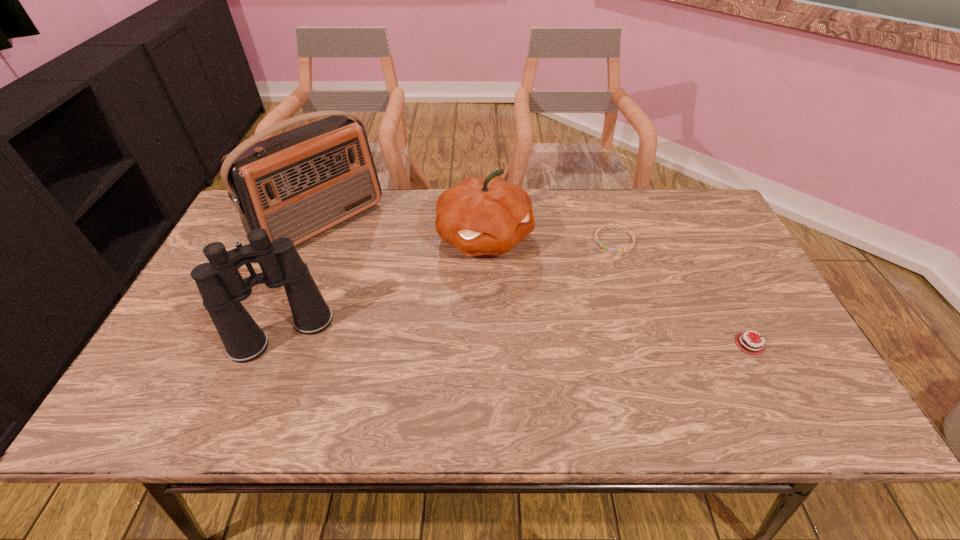
At what (x,y) coordinates should I click in order to perform the action: click on free spot on the desktop that is between the binoculars and the second shortest object and is positioned on the front face of the third object from left to right. Please return your answer as a coordinate pair (x, y). The height and width of the screenshot is (540, 960). Looking at the image, I should click on (558, 340).

The height and width of the screenshot is (540, 960). I want to click on vacant space on the desktop that is between the binoculars and the rightmost object and is positioned on the surface of the bracelet showing star-shaped elements, so [529, 340].

Locate an element on the screen. Image resolution: width=960 pixels, height=540 pixels. vacant space on the desktop that is between the binoculars and the rightmost object and is positioned on the front-facing side of the radio receiver is located at coordinates (455, 338).